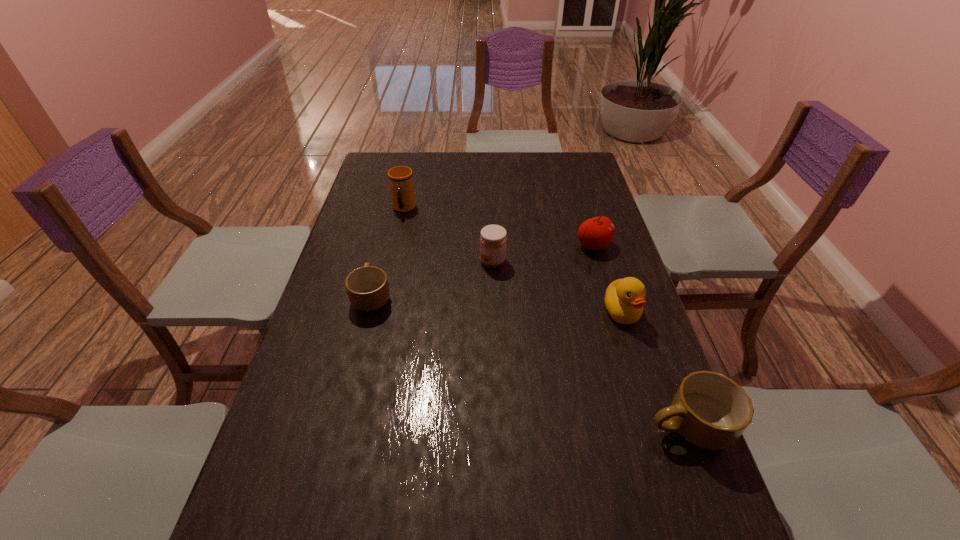
In order to click on spot to insert another mug for uniform distribution in this screenshot , I will do `click(510, 353)`.